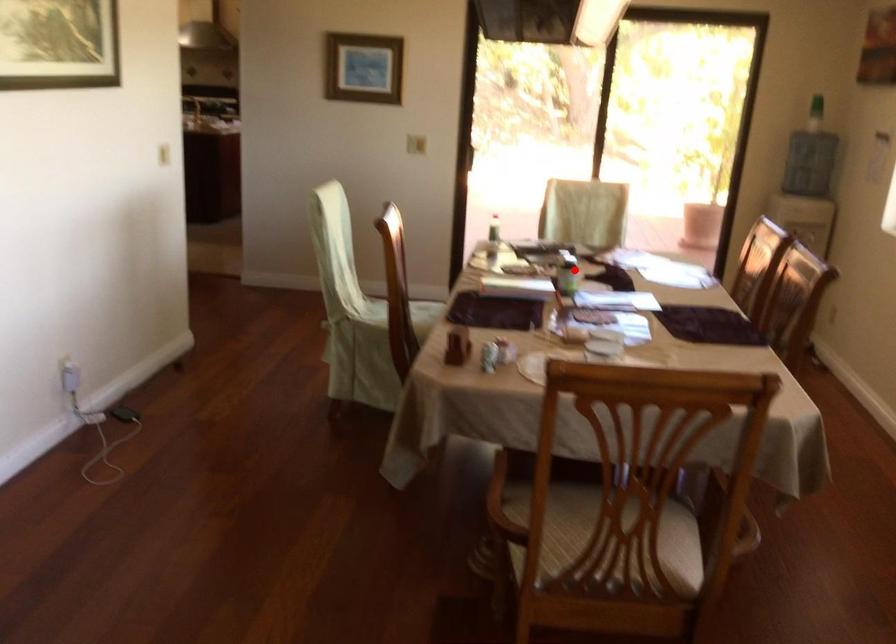
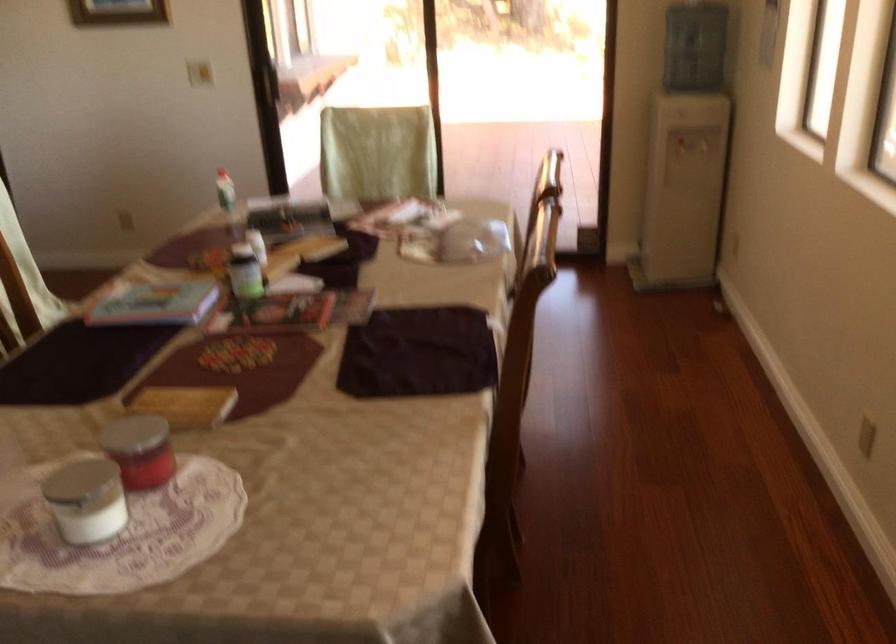
In the second image, find the point that corresponds to the highlighted location in the first image.

(245, 272)